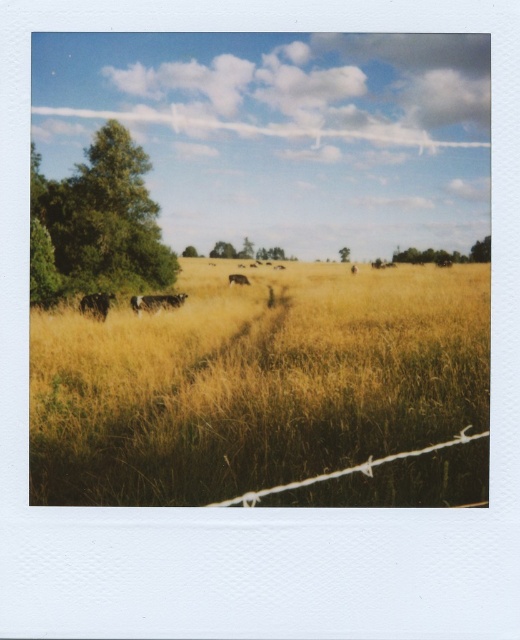
You are a photographer planning to capture the black speckled cow at left and the green leafy tree at upper right in the same frame. Given their relative sizes in the image, which object would appear smaller in your photo?

The black speckled cow at left would appear smaller in the photo because it has a smaller size compared to the green leafy tree at upper right.

You are standing in the middle of the yellow grassy field at lower left and want to reach the brown furry cow at lower left. Which direction should you go to get closer to the cow?

Since the yellow grassy field at lower left might be wider than the brown furry cow at lower left, you should move towards the center of the field to approach the cow.

You are a photographer standing at the camera position. You want to capture a closeup shot of the yellow grassy field at lower left. Considering the distance between you and the field, can you use a standard 50mm lens to achieve this without moving closer? Please explain.

The yellow grassy field at lower left is 14.51 feet away from the camera. A standard 50mm lens typically requires a minimum focusing distance of around 1.5 to 3 feet to capture closeup details effectively. Since the distance is significantly larger than the lens capability, you cannot achieve a closeup shot without moving closer or using a macro lens designed for longer distances.